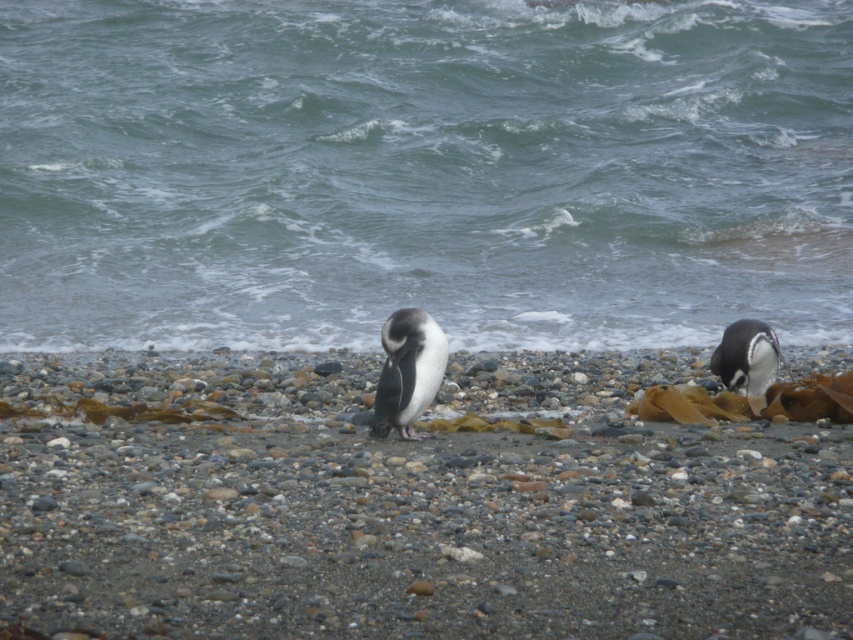
Question: Which object is positioned closest to the black and white feathers at center?

Choices:
 (A) smooth pebble at center
 (B) white glossy penguin at right
 (C) greenish-blue water at center

Answer: (A)

Question: Considering the real-world distances, which object is closest to the smooth pebble at center?

Choices:
 (A) greenish-blue water at center
 (B) black and white feathers at center

Answer: (B)

Question: Observing the image, what is the correct spatial positioning of greenish-blue water at center in reference to white glossy penguin at right?

Choices:
 (A) below
 (B) above

Answer: (B)

Question: Does greenish-blue water at center appear on the right side of white glossy penguin at right?

Choices:
 (A) yes
 (B) no

Answer: (B)

Question: Estimate the real-world distances between objects in this image. Which object is farther from the black and white feathers at center?

Choices:
 (A) smooth pebble at center
 (B) greenish-blue water at center

Answer: (B)

Question: Is greenish-blue water at center thinner than white glossy penguin at right?

Choices:
 (A) no
 (B) yes

Answer: (A)